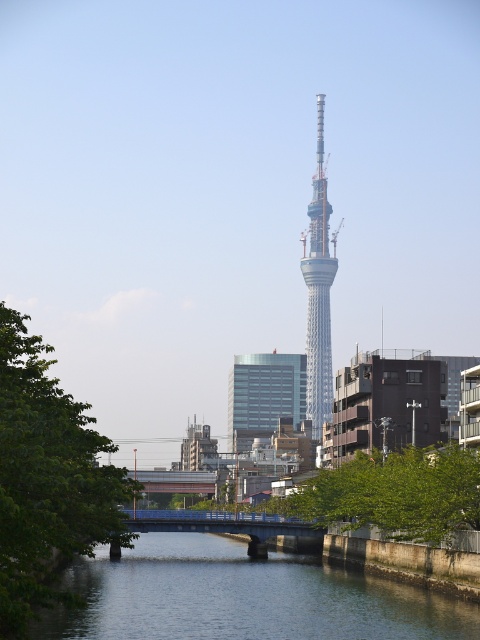
Which is below, clear water at center or green leafy tree at lower left?

clear water at center

Who is more distant from viewer, (147,609) or (60,497)?

The point (147,609) is more distant.

The height and width of the screenshot is (640, 480). What do you see at coordinates (241, 596) in the screenshot?
I see `clear water at center` at bounding box center [241, 596].

This screenshot has width=480, height=640. I want to click on clear water at center, so click(241, 596).

Looking at this image, between green leafy tree at lower left and silver metallic tower at center, which one appears on the left side from the viewer's perspective?

green leafy tree at lower left is more to the left.

Does point (39, 442) come behind point (324, 198)?

No, it is not.

This screenshot has width=480, height=640. Find the location of `green leafy tree at lower left`. green leafy tree at lower left is located at coordinates (47, 477).

This screenshot has width=480, height=640. What do you see at coordinates (241, 596) in the screenshot?
I see `clear water at center` at bounding box center [241, 596].

Between clear water at center and silver metallic tower at center, which one appears on the left side from the viewer's perspective?

From the viewer's perspective, clear water at center appears more on the left side.

Looking at this image, measure the distance between point (144, 605) and camera.

A distance of 260.60 feet exists between point (144, 605) and camera.

Find the location of a particular element. This screenshot has width=480, height=640. clear water at center is located at coordinates (241, 596).